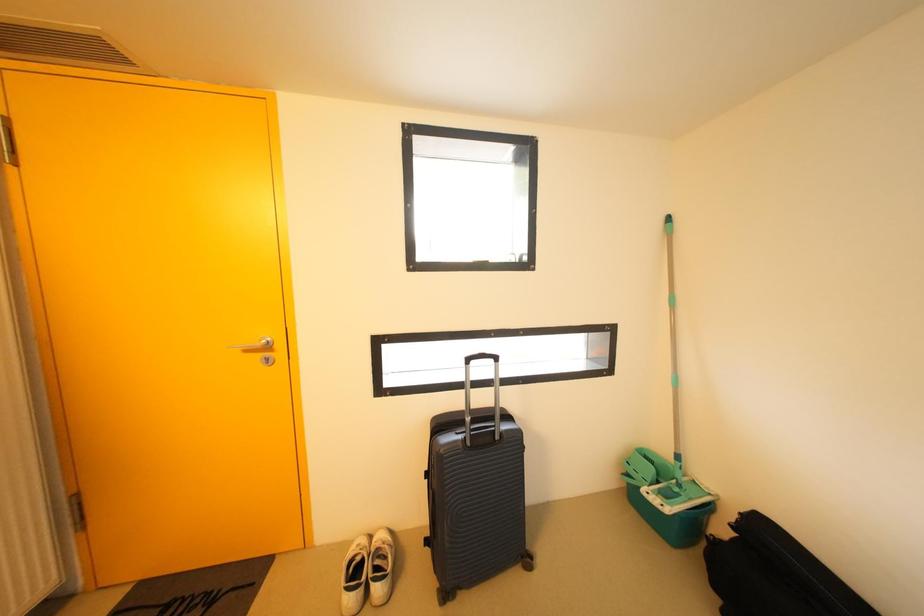
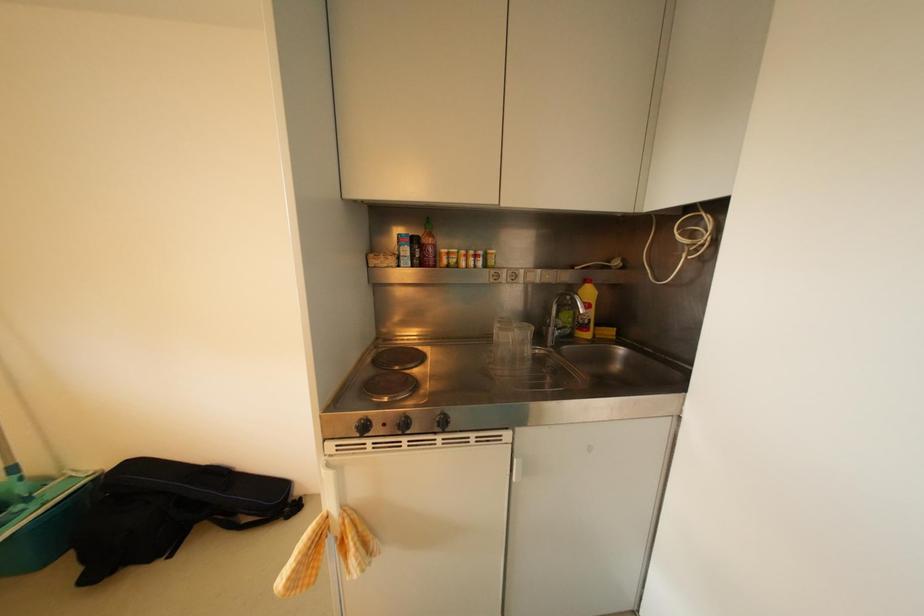
Question: The images are taken continuously from a first-person perspective. In which direction is your viewpoint rotating?

Choices:
 (A) Left
 (B) Right
 (C) Up
 (D) Down

Answer: (B)